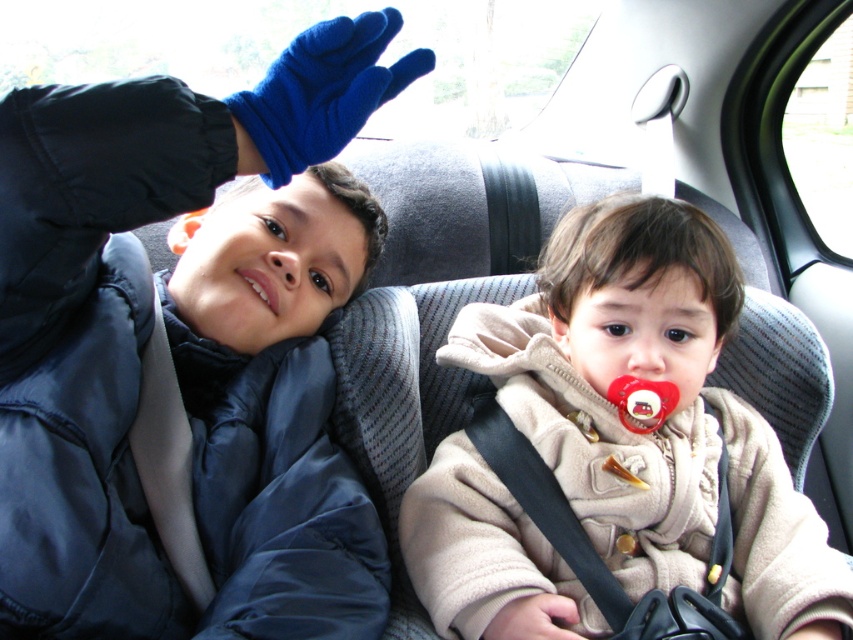
Question: Among these points, which one is farthest from the camera?

Choices:
 (A) (741, 417)
 (B) (260, 282)

Answer: (A)

Question: Which object is positioned closest to the smooth skin nose at center?

Choices:
 (A) beige fleece jacket at center
 (B) white glossy teeth at center

Answer: (A)

Question: Is beige fleece jacket at center smaller than smooth skin nose at center?

Choices:
 (A) no
 (B) yes

Answer: (A)

Question: Does beige fleece jacket at center appear on the left side of matte skin nose at center?

Choices:
 (A) no
 (B) yes

Answer: (A)

Question: Which of the following is the closest to the observer?

Choices:
 (A) white glossy teeth at center
 (B) smooth skin nose at center

Answer: (B)

Question: Considering the relative positions of matte skin nose at center and white glossy teeth at center in the image provided, where is matte skin nose at center located with respect to white glossy teeth at center?

Choices:
 (A) right
 (B) left

Answer: (A)